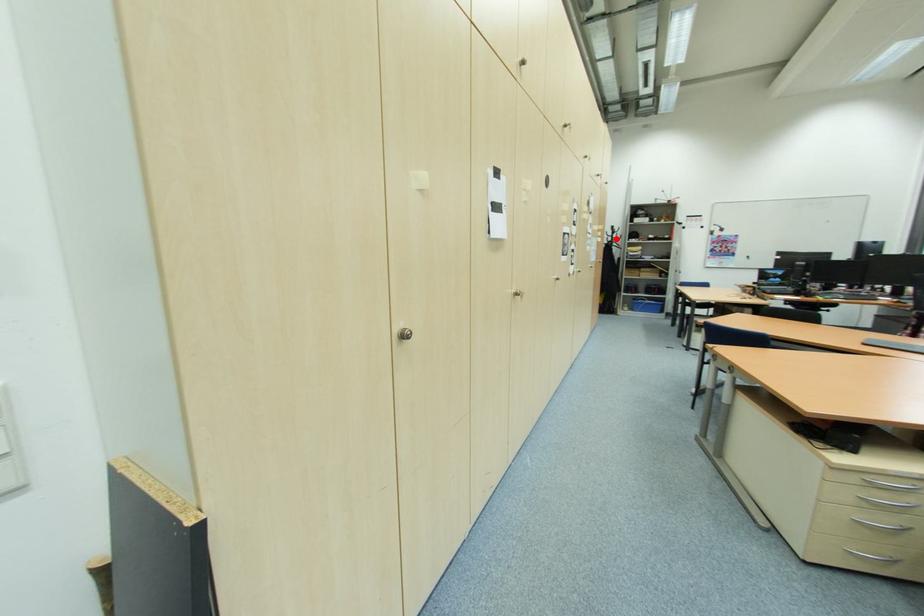
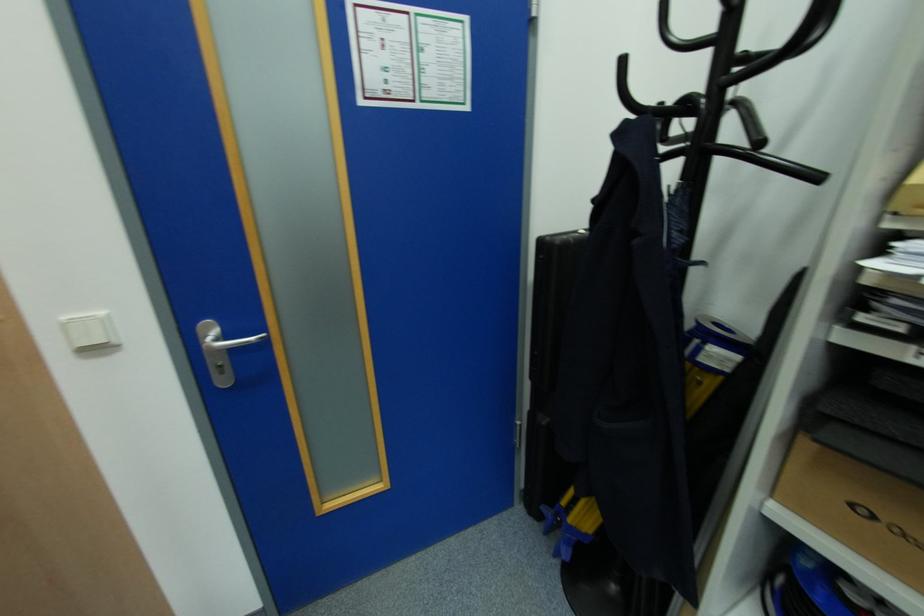
Question: I am providing you with two images of the same scene from different viewpoints. Image1 has a red point marked. In image2, the corresponding 3D location appears at what relative position? Reply with the corresponding letter.

Choices:
 (A) Closer
 (B) Farther

Answer: (B)